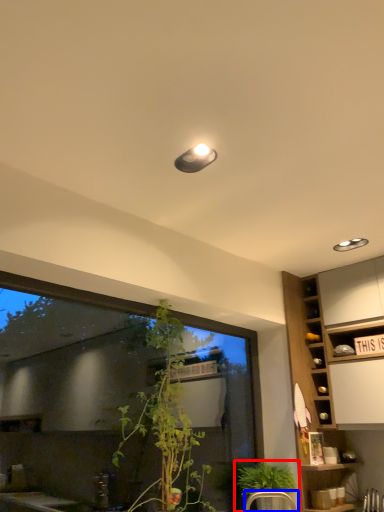
Question: Among these objects, which one is nearest to the camera, houseplant (highlighted by a red box) or armchair (highlighted by a blue box)?

Choices:
 (A) houseplant
 (B) armchair

Answer: (B)